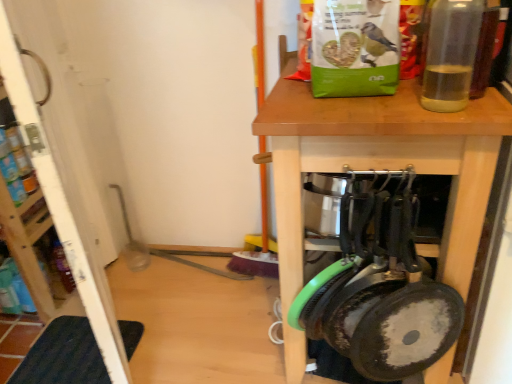
Find the location of `vacant space situated on the left part of wooden table at center`. vacant space situated on the left part of wooden table at center is located at coordinates coord(213,317).